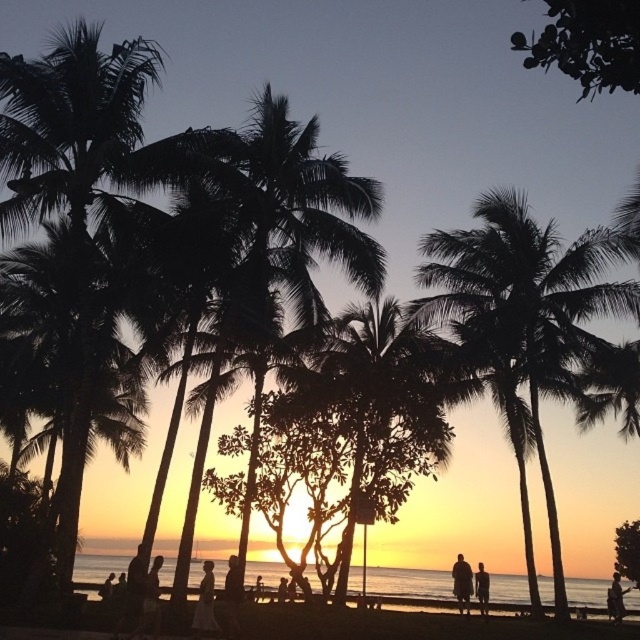
Which is more to the left, silhouette human at center or smooth skin person at lower right?

A: From the viewer's perspective, silhouette human at center appears more on the left side.

The height and width of the screenshot is (640, 640). What do you see at coordinates (461, 582) in the screenshot? I see `silhouette human at center` at bounding box center [461, 582].

Image resolution: width=640 pixels, height=640 pixels. I want to click on silhouette human at center, so click(461, 582).

Where is `silhouette human at center`? The height and width of the screenshot is (640, 640). silhouette human at center is located at coordinates (461, 582).

Looking at this image, which is above, smooth skin person at lower right or white cotton dress at center?

Positioned higher is white cotton dress at center.

Who is more forward, (624, 612) or (284, 582)?

Point (624, 612) is more forward.

I want to click on smooth skin person at lower right, so click(616, 598).

Which of these two, silhouette figure at center or smooth skin person at lower right, stands taller?

With more height is silhouette figure at center.

Is point (209, 564) behind point (616, 600)?

No, (209, 564) is in front of (616, 600).

Where is `silhouette figure at center`? This screenshot has width=640, height=640. silhouette figure at center is located at coordinates (205, 604).